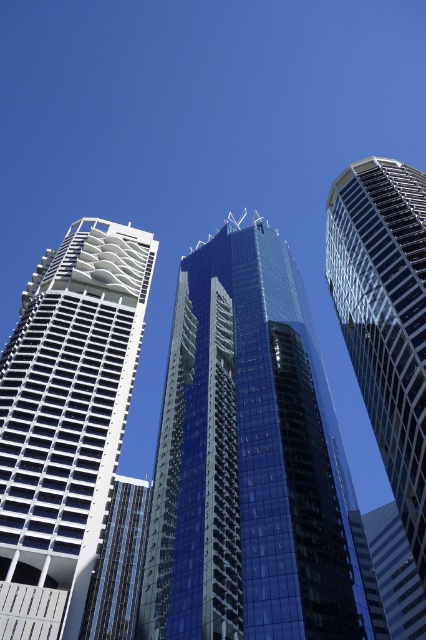
You are standing at the point marked by coordinates point (252,465) in the image. Looking around, you see the shiny glass skyscraper at center. Which direction should you face to see the traditional white building with balconies on the left side?

You should face to the left because the traditional white building with balconies is located on the left side of the image, and the point 0.727, 0952 is at the center of the shiny glass skyscraper. Facing left from the center point will allow you to see the traditional white building with balconies.

You are an architect analyzing the spatial arrangement of the buildings in the image. Which of the two skyscrapers, the shiny glass skyscraper at center or the glassy reflective skyscraper at right, is located lower in the image?

The shiny glass skyscraper at center is positioned under the glassy reflective skyscraper at right, so it is located lower in the image.

You are standing at the point with coordinates point (190, 576) and want to walk towards the point with coordinates point (408, 225). Based on the scene description, will you be moving towards the central building or away from it?

Since point (190, 576) is in front of point (408, 225), moving from point (190, 576) towards point (408, 225) would mean moving away from the central building.